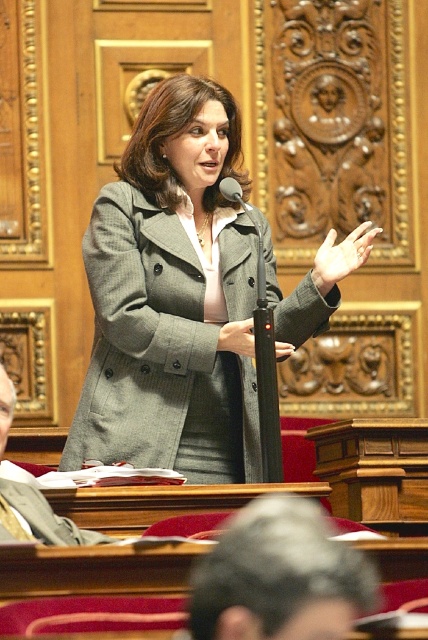
You are an assistant organizing a formal event. You have two coats displayed at the center of the stage. The gray wool coat at center and the matte gray coat at center. Which coat should you place higher on the stage to ensure visibility for the audience?

The gray wool coat at center has a greater height compared to matte gray coat at center, so placing it higher on the stage would ensure better visibility for the audience.

You are a fashion designer observing two coats displayed at a store window. The coats are labeled as the gray wool coat at center and the matte gray coat at center. Which coat has a larger size?

The gray wool coat at center is bigger than the matte gray coat at center, so the gray wool coat at center has a larger size.